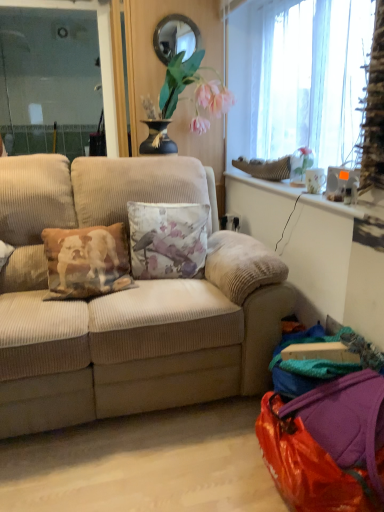
Question: Looking at the image, does translucent fabric window at upper right seem bigger or smaller compared to floral fabric cushion at center?

Choices:
 (A) big
 (B) small

Answer: (A)

Question: Is translucent fabric window at upper right inside or outside of floral fabric cushion at center?

Choices:
 (A) outside
 (B) inside

Answer: (A)

Question: Which object is positioned farthest from the shiny orange bag at lower right?

Choices:
 (A) matte glass mirror at upper center
 (B) beige corduroy couch at center
 (C) floral fabric cushion at center
 (D) translucent fabric window at upper right

Answer: (A)

Question: Which object is the closest to the translucent fabric window at upper right?

Choices:
 (A) beige corduroy couch at center
 (B) matte glass mirror at upper center
 (C) floral fabric cushion at center
 (D) shiny orange bag at lower right

Answer: (B)